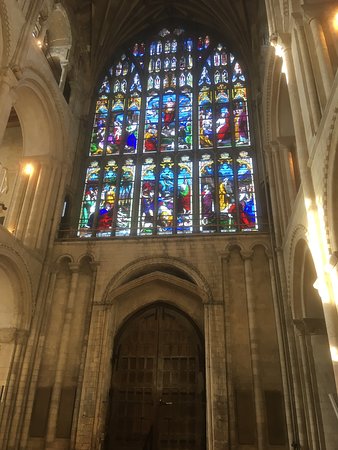
Where is `doorway`? This screenshot has height=450, width=338. doorway is located at coordinates (316, 351).